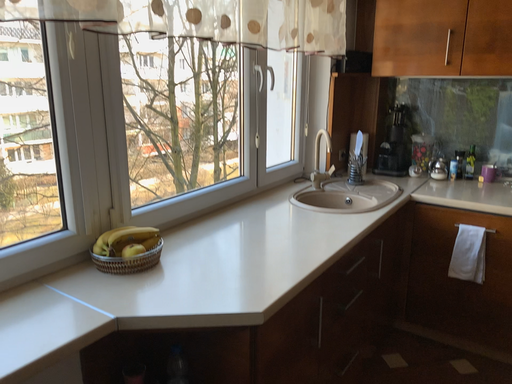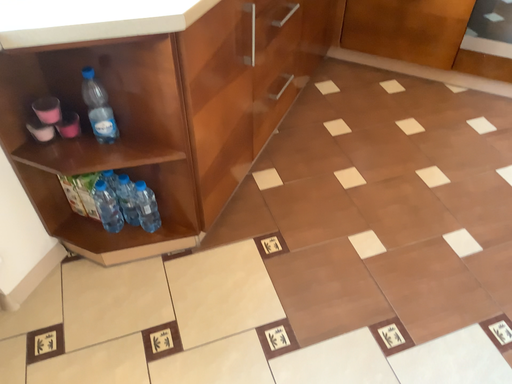
Question: How did the camera likely rotate when shooting the video?

Choices:
 (A) rotated downward
 (B) rotated upward

Answer: (A)